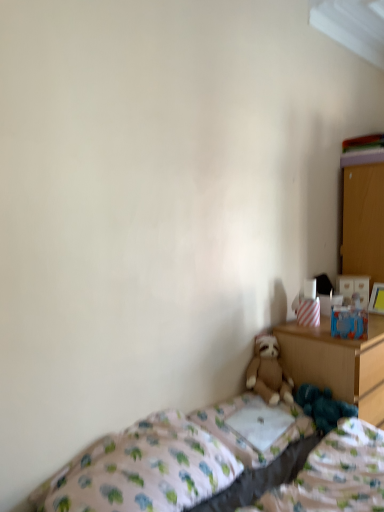
Question: Is dark blue plush at lower right bigger or smaller than white fabric pillow at center?

Choices:
 (A) big
 (B) small

Answer: (A)

Question: Visually, is dark blue plush at lower right positioned to the left or to the right of white fabric pillow at center?

Choices:
 (A) left
 (B) right

Answer: (B)

Question: Which object is positioned closest to the white fabric pillow at center?

Choices:
 (A) dark blue plush at lower right
 (B) patterned fabric bed at lower right
 (C) wooden dresser at right
 (D) brown plush teddy bear at lower center
 (E) wooden nightstand at right

Answer: (D)

Question: Estimate the real-world distances between objects in this image. Which object is farther from the wooden nightstand at right?

Choices:
 (A) dark blue plush at lower right
 (B) patterned fabric bed at lower right
 (C) white fabric pillow at center
 (D) fluffy brown teddy bear at lower right
 (E) wooden dresser at right

Answer: (E)